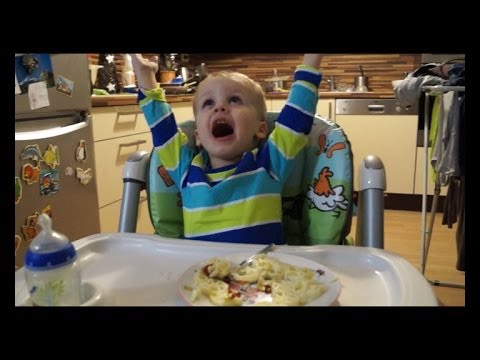
The height and width of the screenshot is (360, 480). I want to click on sippy cups, so click(61, 280).